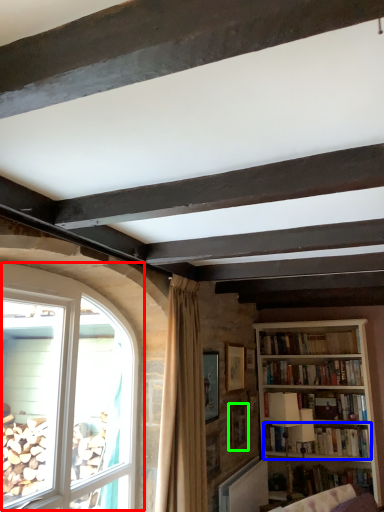
Question: Estimate the real-world distances between objects in this image. Which object is closer to window (highlighted by a red box), book (highlighted by a blue box) or picture frame (highlighted by a green box)?

Choices:
 (A) book
 (B) picture frame

Answer: (B)